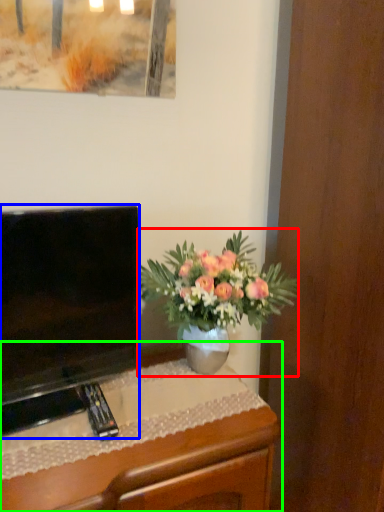
Question: Which object is the closest to the houseplant (highlighted by a red box)? Choose among these: television (highlighted by a blue box) or desk (highlighted by a green box).

Choices:
 (A) television
 (B) desk

Answer: (A)